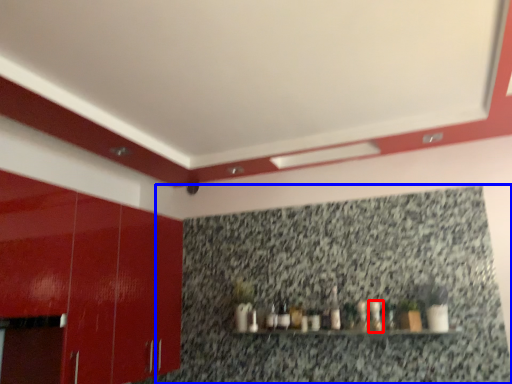
Question: Which point is further to the camera, bottle (highlighted by a red box) or granite (highlighted by a blue box)?

Choices:
 (A) bottle
 (B) granite

Answer: (A)